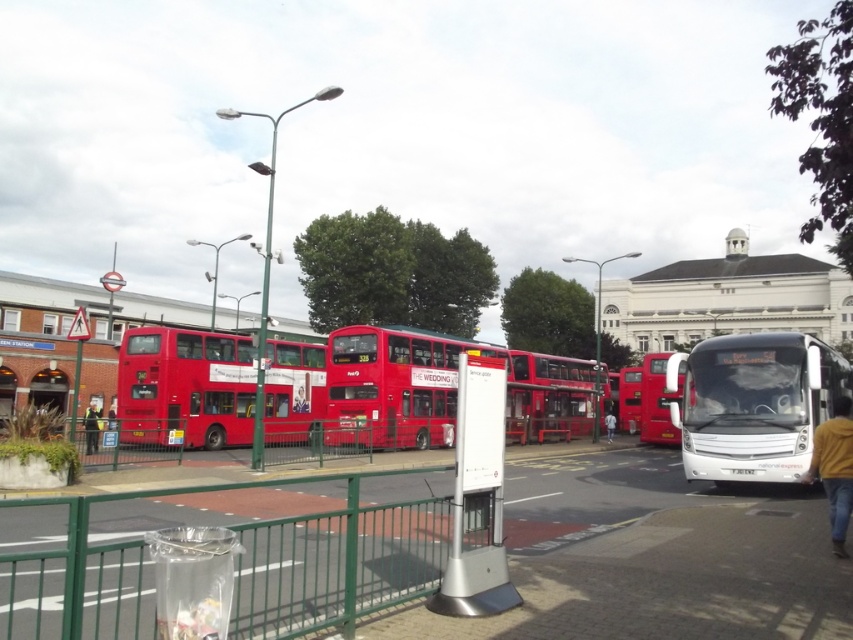
Question: Which point appears closest to the camera in this image?

Choices:
 (A) (753, 387)
 (B) (270, 608)
 (C) (653, 422)

Answer: (B)

Question: Does white glossy coach at center have a smaller size compared to matte red double-decker bus at center?

Choices:
 (A) yes
 (B) no

Answer: (A)

Question: Does green metal fence at lower left have a greater width compared to matte red bus at center?

Choices:
 (A) yes
 (B) no

Answer: (A)

Question: Is green metal fence at lower left wider than matte red bus at center?

Choices:
 (A) yes
 (B) no

Answer: (A)

Question: Which of these objects is positioned farthest from the white glossy coach at center?

Choices:
 (A) green metal fence at lower left
 (B) matte red bus at center

Answer: (A)

Question: Estimate the real-world distances between objects in this image. Which object is closer to the white glossy coach at center?

Choices:
 (A) matte red bus at center
 (B) matte red double-decker bus at center
 (C) green metal fence at lower left

Answer: (A)